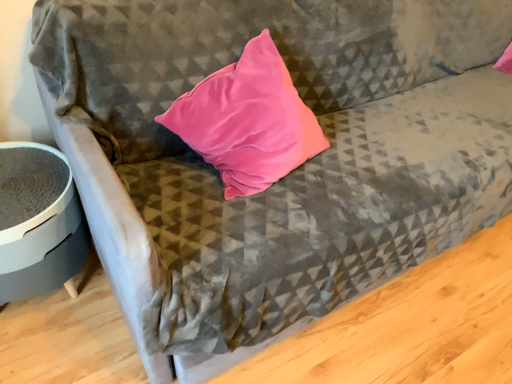
Locate an element on the screen. The height and width of the screenshot is (384, 512). matte gray round table at left is located at coordinates (38, 222).

Describe the element at coordinates (38, 222) in the screenshot. Image resolution: width=512 pixels, height=384 pixels. I see `matte gray round table at left` at that location.

Locate an element on the screen. The image size is (512, 384). matte gray round table at left is located at coordinates (38, 222).